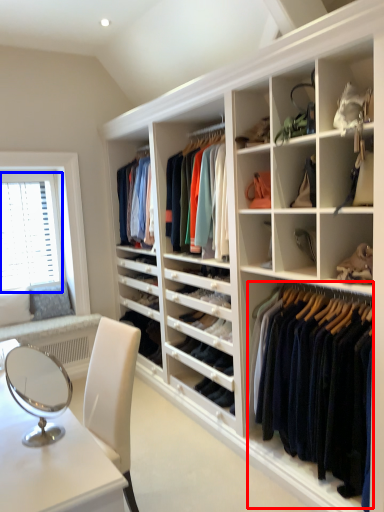
Question: Which point is further to the camera, clothing (highlighted by a red box) or window screen (highlighted by a blue box)?

Choices:
 (A) clothing
 (B) window screen

Answer: (B)